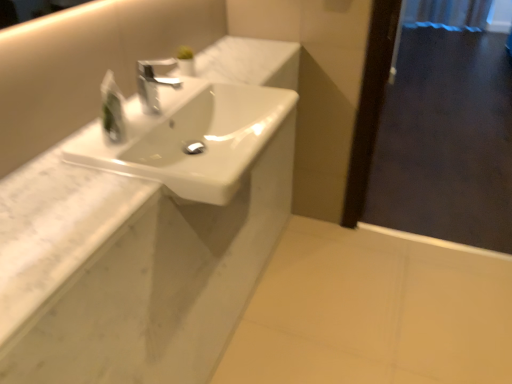
This screenshot has height=384, width=512. I want to click on free space in front of translucent plastic soap dispenser at upper left, so click(x=104, y=150).